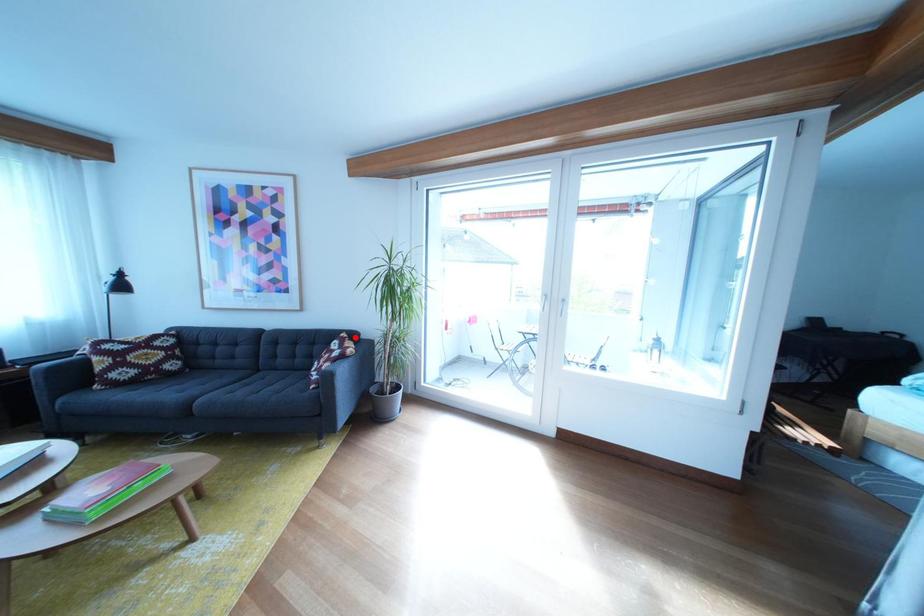
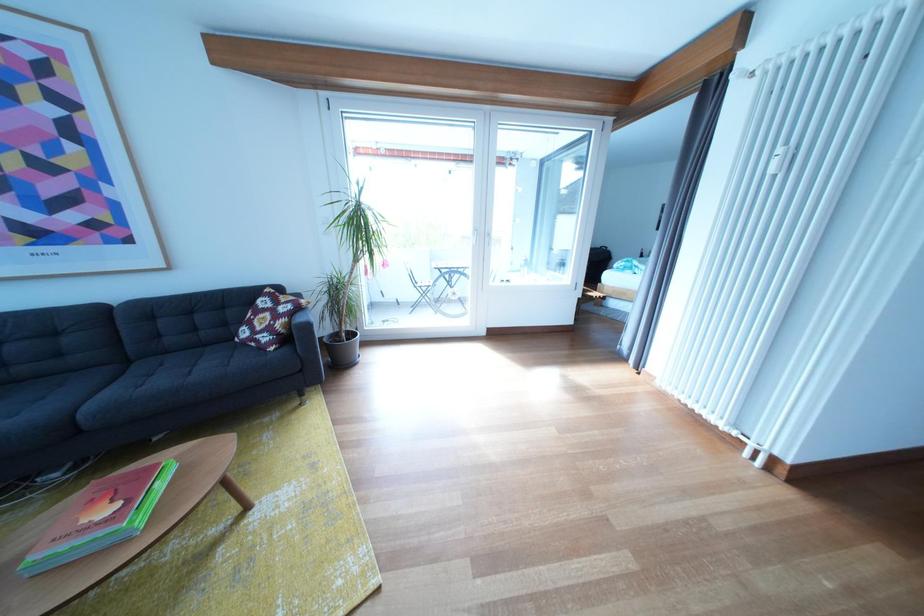
Question: I am providing you with two images of the same scene from different viewpoints. A red point is marked on the first image. At the location where the point appears in image 1, is it still visible in image 2?

Choices:
 (A) Yes
 (B) No

Answer: (A)